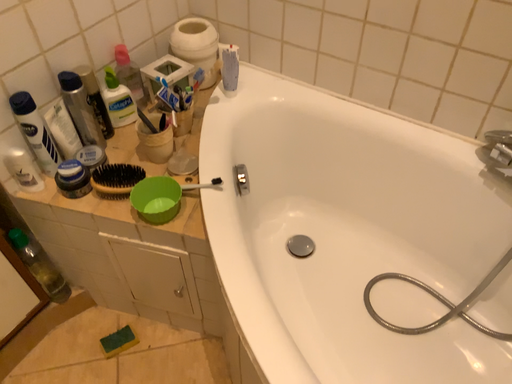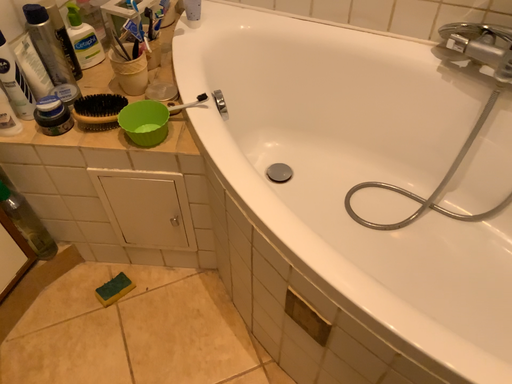
Question: How did the camera likely rotate when shooting the video?

Choices:
 (A) rotated left
 (B) rotated right

Answer: (B)